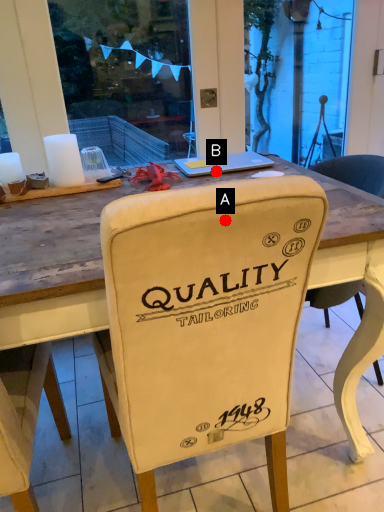
Question: Two points are circled on the image, labeled by A and B beside each circle. Which point is farther to the camera?

Choices:
 (A) A is further
 (B) B is further

Answer: (B)